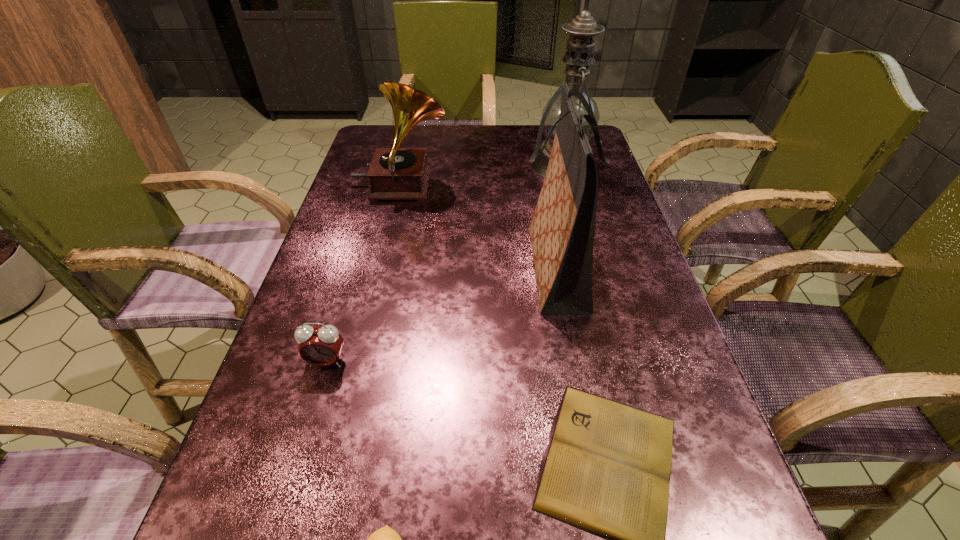
You are a GUI agent. You are given a task and a screenshot of the screen. Output one action in this format:
    pyautogui.click(x=<x>, y=<y>)
    Task: Click on the blank area located 0.100m on the clock face of the alarm clock
    This screenshot has width=960, height=540.
    Given the screenshot: What is the action you would take?
    pyautogui.click(x=308, y=423)

What are the coordinates of `object that is at the far edge` in the screenshot? It's located at (579, 54).

Locate an element on the screen. phonograph record that is at the left edge is located at coordinates (395, 173).

You are a GUI agent. You are given a task and a screenshot of the screen. Output one action in this format:
    pyautogui.click(x=<x>, y=<y>)
    Task: Click on the alarm clock present at the left edge
    
    Given the screenshot: What is the action you would take?
    pyautogui.click(x=321, y=346)

At what (x,y) coordinates should I click in order to perform the action: click on oil lamp located at the right edge. Please return your answer as a coordinate pair (x, y). This screenshot has height=540, width=960. Looking at the image, I should click on (579, 54).

Image resolution: width=960 pixels, height=540 pixels. I want to click on shopping bag that is positioned at the right edge, so click(562, 229).

Locate an element on the screen. The image size is (960, 540). object located at the far right corner is located at coordinates (579, 54).

Find the location of `vacant space at the far edge of the desktop`. vacant space at the far edge of the desktop is located at coordinates (486, 126).

Where is `free space at the left edge of the desktop`? Image resolution: width=960 pixels, height=540 pixels. free space at the left edge of the desktop is located at coordinates (396, 207).

The image size is (960, 540). In the image, there is a desktop. Identify the location of vacant space at the far left corner. (372, 132).